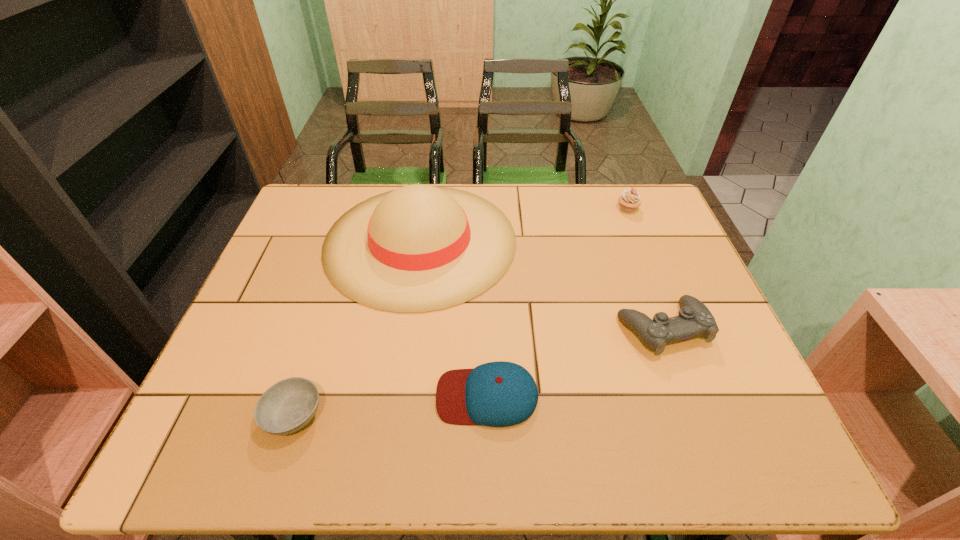
This screenshot has height=540, width=960. I want to click on vacant space located 0.140m with the bill of the baseball cap facing forward, so click(x=370, y=396).

In order to click on vacant point located on the back of the bowl in this screenshot , I will do `click(344, 260)`.

I want to click on sombrero present at the far edge, so click(419, 248).

The image size is (960, 540). What are the coordinates of `cupcake positioned at the far edge` in the screenshot? It's located at point(630,199).

Find the location of `baseball cap located in the near edge section of the desktop`. baseball cap located in the near edge section of the desktop is located at coordinates (497, 394).

Locate an element on the screen. bowl that is at the near edge is located at coordinates (287, 406).

At what (x,y) coordinates should I click in order to perform the action: click on sombrero that is positioned at the left edge. Please return your answer as a coordinate pair (x, y). The image size is (960, 540). Looking at the image, I should click on (419, 248).

This screenshot has height=540, width=960. What are the coordinates of `bowl present at the left edge` in the screenshot? It's located at (287, 406).

Find the location of a particular element. The height and width of the screenshot is (540, 960). cupcake located in the right edge section of the desktop is located at coordinates (630, 199).

Where is `control at the right edge`? control at the right edge is located at coordinates (694, 319).